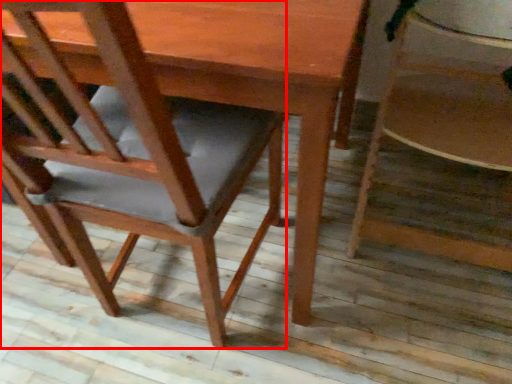
Question: From the image's perspective, where is chair (annotated by the red box) located in relation to chair in the image?

Choices:
 (A) above
 (B) below

Answer: (B)